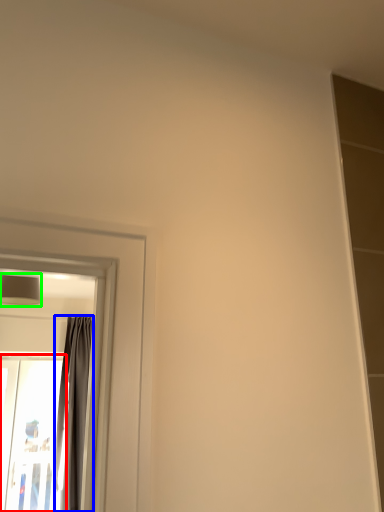
Question: Based on their relative distances, which object is farther from screen door (highlighted by a red box)? Choose from curtain (highlighted by a blue box) and lamp (highlighted by a green box).

Choices:
 (A) curtain
 (B) lamp

Answer: (B)